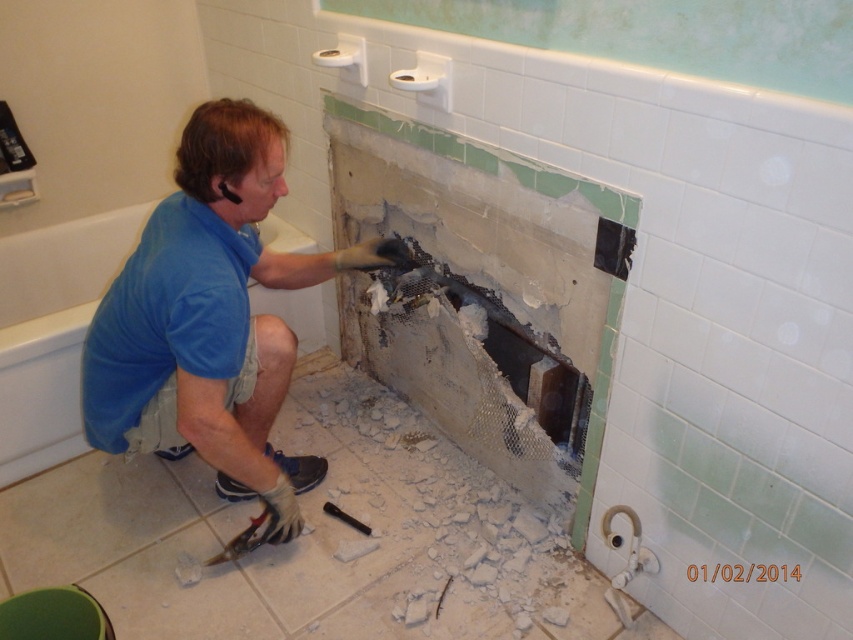
Who is positioned more to the left, blue fabric shirt at center or blue fabric shirt at lower left?

blue fabric shirt at lower left

Can you confirm if blue fabric shirt at center is positioned above blue fabric shirt at lower left?

No, blue fabric shirt at center is not above blue fabric shirt at lower left.

The width and height of the screenshot is (853, 640). What do you see at coordinates (212, 317) in the screenshot?
I see `blue fabric shirt at center` at bounding box center [212, 317].

Locate an element on the screen. This screenshot has height=640, width=853. blue fabric shirt at center is located at coordinates (212, 317).